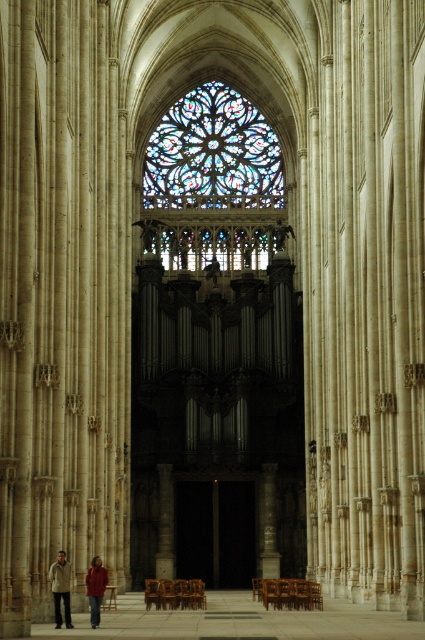
Question: Is khaki cotton shirt at lower left below red sweater at lower left?

Choices:
 (A) no
 (B) yes

Answer: (A)

Question: Which of the following is the closest to the observer?

Choices:
 (A) (164, 196)
 (B) (90, 604)

Answer: (B)

Question: Which object appears closest to the camera in this image?

Choices:
 (A) stained glass at upper center
 (B) khaki cotton shirt at lower left
 (C) red sweater at lower left

Answer: (B)

Question: In this image, where is khaki cotton shirt at lower left located relative to red sweater at lower left?

Choices:
 (A) left
 (B) right

Answer: (A)

Question: Observing the image, what is the correct spatial positioning of stained glass at upper center in reference to red sweater at lower left?

Choices:
 (A) below
 (B) above

Answer: (B)

Question: Among these objects, which one is farthest from the camera?

Choices:
 (A) stained glass at upper center
 (B) red sweater at lower left
 (C) khaki cotton shirt at lower left

Answer: (A)